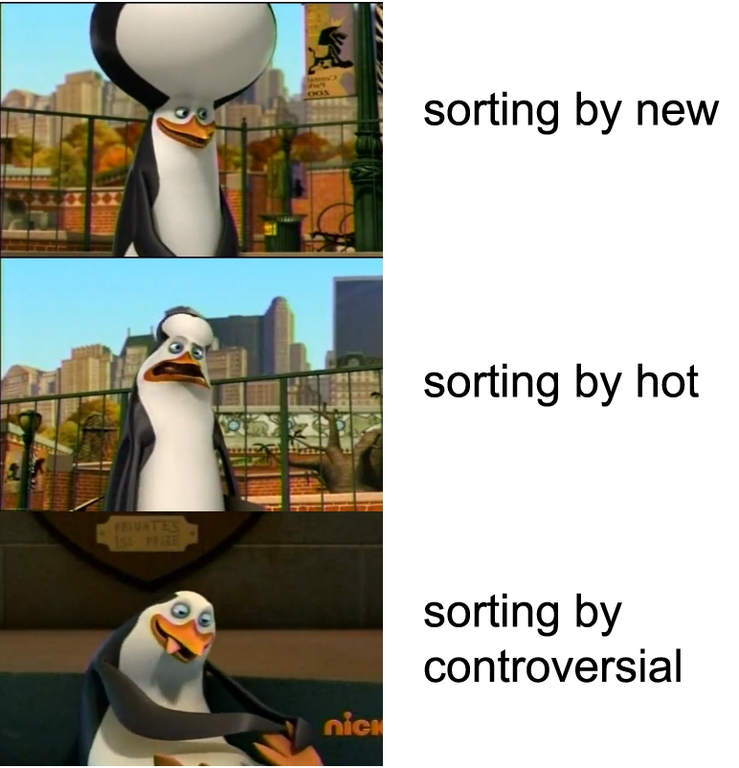
Find the location of a particular element. Image resolution: width=739 pixels, height=768 pixels. balustrades is located at coordinates (89, 131), (282, 402).